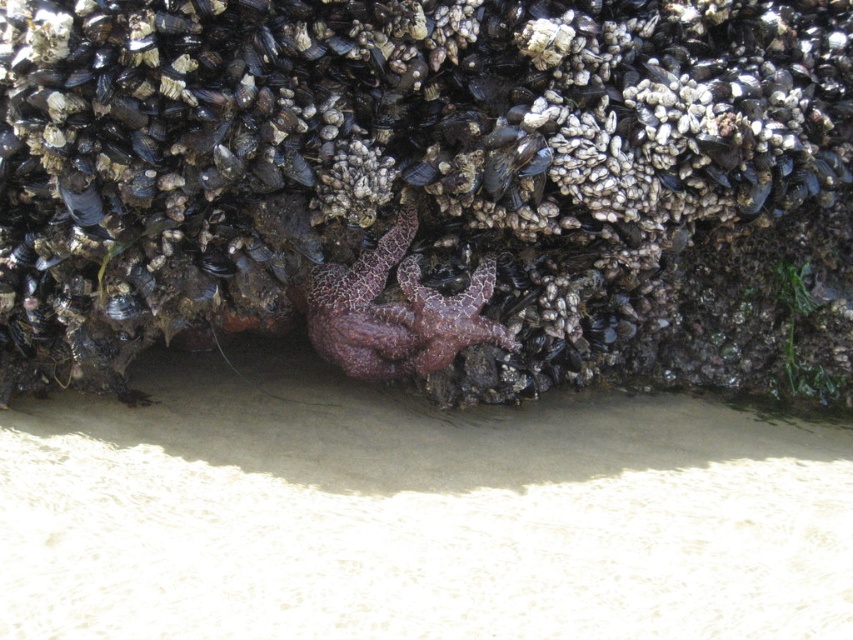
You are a marine biologist observing the rocky surface. You notice the purple coral at center and the purple rough starfish at center. Which object has a greater width?

The purple coral at center has a greater width than the purple rough starfish at center.

You are a marine biologist examining the rocky surface. You notice the smooth dark shells at center and the purple matte starfish at center. Based on their positions, which object is closer to the water surface?

The smooth dark shells at center is located above the purple matte starfish at center, so it is closer to the water surface.

You are a marine biologist examining the rocky surface. You notice the smooth dark shells at center and the purple matte starfish at center. Which object takes up more space in the image?

The smooth dark shells at center is larger in size than the purple matte starfish at center, so it takes up more space in the image.